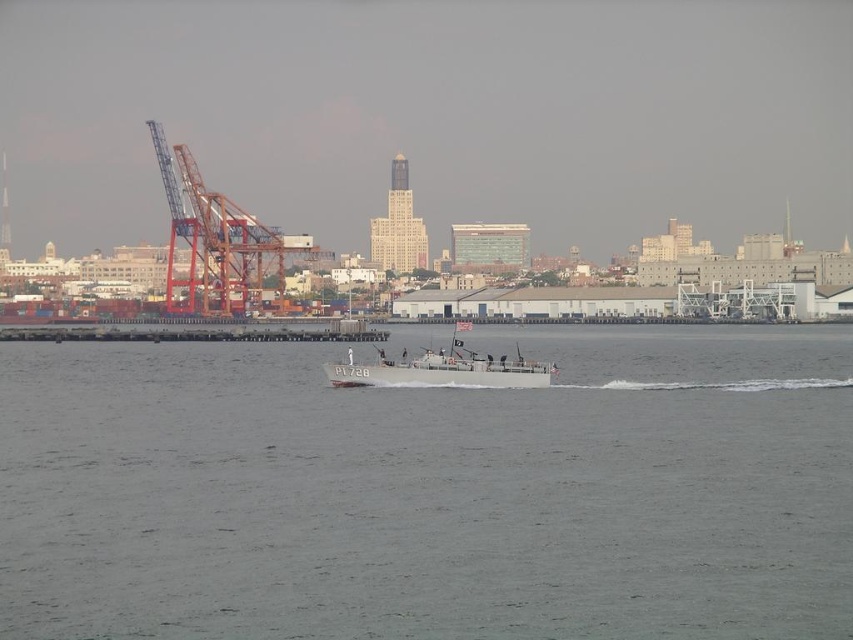
You are a delivery drone that needs to fly from the metallic orange crane at left to the gray water at center to drop off a package. Given that your drone has a maximum flight range of 200 meters, will you be able to make the trip without recharging?

The distance between the metallic orange crane at left and the gray water at center is 198.27 meters, which is within the drone s 200 meter range. Yes, the drone can make the trip without recharging.

You are navigating a small boat marked with PT 728 and need to dock at the waterfront. The boat requires a clear path to the dock without obstacles. Is there a metallic orange crane at left in your direct line of sight when approaching the dock from the water?

The metallic orange crane at left is located at point (213, 243), which means it is positioned to the left side of the dock area. Since the boat is approaching from the water, the metallic orange crane at left would be to the side and not directly in the path, so the direct line of sight to the dock remains clear.